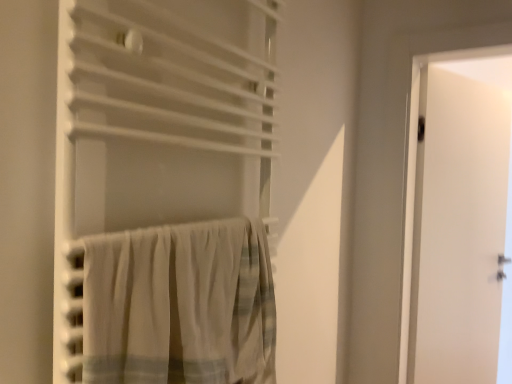
How much space does white cotton curtain at lower left, arranged as the 2th curtain when viewed from the top, occupy horizontally?

white cotton curtain at lower left, arranged as the 2th curtain when viewed from the top, is 1.99 inches in width.

Image resolution: width=512 pixels, height=384 pixels. Identify the location of white matte door at right. (460, 220).

Is white matte door at right not near white cotton curtain at lower left, arranged as the 2th curtain when viewed from the top?

Yes, white matte door at right and white cotton curtain at lower left, arranged as the 2th curtain when viewed from the top, are quite far apart.

Which point is more distant from viewer, (x=414, y=271) or (x=243, y=236)?

The point (x=414, y=271) is behind.

From the image's perspective, does white matte door at right appear higher than white cotton curtain at lower left, arranged as the 2th curtain when viewed from the top?

No, from the image's perspective, white matte door at right is not over white cotton curtain at lower left, arranged as the 2th curtain when viewed from the top.

Does white matte door at right appear on the left side of white cotton curtain at lower left, arranged as the 2th curtain when viewed from the top?

In fact, white matte door at right is to the right of white cotton curtain at lower left, arranged as the 2th curtain when viewed from the top.

Looking at the image, does white fabric curtain at center, the 2th curtain positioned from the bottom, seem bigger or smaller compared to white cotton curtain at lower left, arranged as the 2th curtain when viewed from the top?

In the image, white fabric curtain at center, the 2th curtain positioned from the bottom, appears to be larger than white cotton curtain at lower left, arranged as the 2th curtain when viewed from the top.

Is white fabric curtain at center, which is counted as the 1th curtain, starting from the top, taller or shorter than white cotton curtain at lower left, arranged as the 1th curtain when ordered from the bottom?

Clearly, white fabric curtain at center, which is counted as the 1th curtain, starting from the top, is taller compared to white cotton curtain at lower left, arranged as the 1th curtain when ordered from the bottom.

Between white fabric curtain at center, the 2th curtain positioned from the bottom, and white cotton curtain at lower left, arranged as the 2th curtain when viewed from the top, which one is positioned in front?

Positioned in front is white fabric curtain at center, the 2th curtain positioned from the bottom.

Is white cotton curtain at lower left, arranged as the 1th curtain when ordered from the bottom, located outside white fabric curtain at center, the 2th curtain positioned from the bottom?

Actually, white cotton curtain at lower left, arranged as the 1th curtain when ordered from the bottom, is within white fabric curtain at center, the 2th curtain positioned from the bottom.

Between white cotton curtain at lower left, arranged as the 1th curtain when ordered from the bottom, and white fabric curtain at center, which is counted as the 1th curtain, starting from the top, which one is positioned in front?

white fabric curtain at center, which is counted as the 1th curtain, starting from the top, is closer to the camera.

Is white cotton curtain at lower left, arranged as the 2th curtain when viewed from the top, wider or thinner than white fabric curtain at center, which is counted as the 1th curtain, starting from the top?

In the image, white cotton curtain at lower left, arranged as the 2th curtain when viewed from the top, appears to be more narrow than white fabric curtain at center, which is counted as the 1th curtain, starting from the top.

How much distance is there between white cotton curtain at lower left, arranged as the 1th curtain when ordered from the bottom, and white fabric curtain at center, the 2th curtain positioned from the bottom?

white cotton curtain at lower left, arranged as the 1th curtain when ordered from the bottom, is 3.63 inches from white fabric curtain at center, the 2th curtain positioned from the bottom.

Relative to white fabric curtain at center, the 2th curtain positioned from the bottom, is white matte door at right in front or behind?

white matte door at right is positioned farther from the viewer than white fabric curtain at center, the 2th curtain positioned from the bottom.

Does point (440, 351) come farther from viewer compared to point (110, 18)?

Yes, it is.

Can you see white matte door at right touching white fabric curtain at center, which is counted as the 1th curtain, starting from the top?

No, white matte door at right is not beside white fabric curtain at center, which is counted as the 1th curtain, starting from the top.

Could you tell me if white matte door at right is turned towards white fabric curtain at center, the 2th curtain positioned from the bottom?

No, white matte door at right is not facing towards white fabric curtain at center, the 2th curtain positioned from the bottom.

Is white cotton curtain at lower left, arranged as the 2th curtain when viewed from the top, taller than white matte door at right?

No.

From a real-world perspective, is white cotton curtain at lower left, arranged as the 1th curtain when ordered from the bottom, physically located above or below white matte door at right?

white cotton curtain at lower left, arranged as the 1th curtain when ordered from the bottom, is situated higher than white matte door at right in the real world.

Is white cotton curtain at lower left, arranged as the 1th curtain when ordered from the bottom, wider or thinner than white matte door at right?

white cotton curtain at lower left, arranged as the 1th curtain when ordered from the bottom, is wider than white matte door at right.

Between white cotton curtain at lower left, arranged as the 2th curtain when viewed from the top, and white matte door at right, which one appears on the left side from the viewer's perspective?

white cotton curtain at lower left, arranged as the 2th curtain when viewed from the top.

Which object is positioned more to the left, white fabric curtain at center, the 2th curtain positioned from the bottom, or white matte door at right?

white fabric curtain at center, the 2th curtain positioned from the bottom.

What's the angular difference between white fabric curtain at center, which is counted as the 1th curtain, starting from the top, and white matte door at right's facing directions?

21.2 degrees.

Looking at this image, can you confirm if white fabric curtain at center, the 2th curtain positioned from the bottom, is wider than white matte door at right?

Correct, the width of white fabric curtain at center, the 2th curtain positioned from the bottom, exceeds that of white matte door at right.

Which of these two, white fabric curtain at center, the 2th curtain positioned from the bottom, or white matte door at right, stands shorter?

Standing shorter between the two is white fabric curtain at center, the 2th curtain positioned from the bottom.

Identify the location of door that is on the right side of white cotton curtain at lower left, arranged as the 1th curtain when ordered from the bottom. This screenshot has height=384, width=512. (460, 220).

Where is `curtain above the white cotton curtain at lower left, arranged as the 2th curtain when viewed from the top (from a real-world perspective)`? Image resolution: width=512 pixels, height=384 pixels. curtain above the white cotton curtain at lower left, arranged as the 2th curtain when viewed from the top (from a real-world perspective) is located at coordinates (166, 191).

Looking at the image, which one is located further to white fabric curtain at center, the 2th curtain positioned from the bottom, white cotton curtain at lower left, arranged as the 1th curtain when ordered from the bottom, or white matte door at right?

Among the two, white matte door at right is located further to white fabric curtain at center, the 2th curtain positioned from the bottom.

Looking at the image, which one is located closer to white matte door at right, white fabric curtain at center, which is counted as the 1th curtain, starting from the top, or white cotton curtain at lower left, arranged as the 2th curtain when viewed from the top?

Among the two, white fabric curtain at center, which is counted as the 1th curtain, starting from the top, is located nearer to white matte door at right.

Considering their positions, is white fabric curtain at center, the 2th curtain positioned from the bottom, positioned closer to white cotton curtain at lower left, arranged as the 2th curtain when viewed from the top, than white matte door at right?

The object closer to white cotton curtain at lower left, arranged as the 2th curtain when viewed from the top, is white fabric curtain at center, the 2th curtain positioned from the bottom.

Estimate the real-world distances between objects in this image. Which object is closer to white matte door at right, white cotton curtain at lower left, arranged as the 1th curtain when ordered from the bottom, or white fabric curtain at center, which is counted as the 1th curtain, starting from the top?

Among the two, white fabric curtain at center, which is counted as the 1th curtain, starting from the top, is located nearer to white matte door at right.

Considering their positions, is white matte door at right positioned further to white fabric curtain at center, the 2th curtain positioned from the bottom, than white cotton curtain at lower left, arranged as the 2th curtain when viewed from the top?

The object further to white fabric curtain at center, the 2th curtain positioned from the bottom, is white matte door at right.

Looking at the image, which one is located closer to white cotton curtain at lower left, arranged as the 2th curtain when viewed from the top, white matte door at right or white fabric curtain at center, the 2th curtain positioned from the bottom?

Among the two, white fabric curtain at center, the 2th curtain positioned from the bottom, is located nearer to white cotton curtain at lower left, arranged as the 2th curtain when viewed from the top.

Where is `curtain between white fabric curtain at center, which is counted as the 1th curtain, starting from the top, and white matte door at right in the front-back direction`? This screenshot has width=512, height=384. curtain between white fabric curtain at center, which is counted as the 1th curtain, starting from the top, and white matte door at right in the front-back direction is located at coordinates (180, 305).